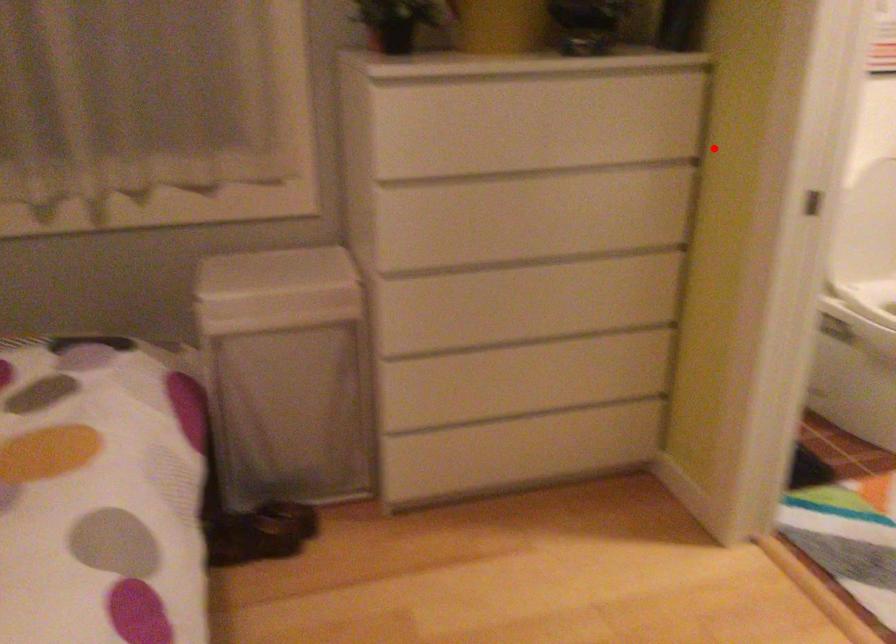
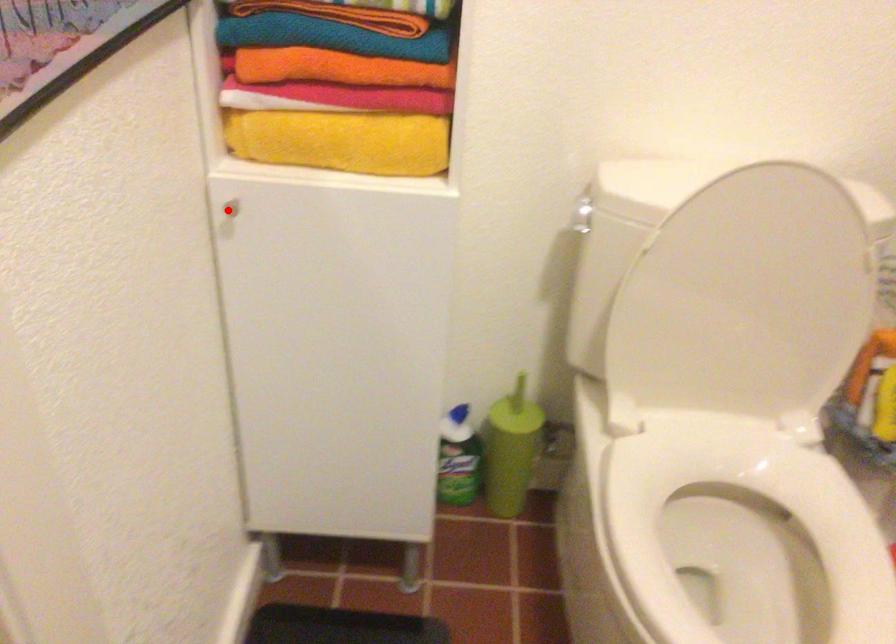
I am providing you with two images of the same scene from different viewpoints. A red point is marked on the first image and another point is marked on the second image. Do the highlighted points in image1 and image2 indicate the same real-world spot?

No